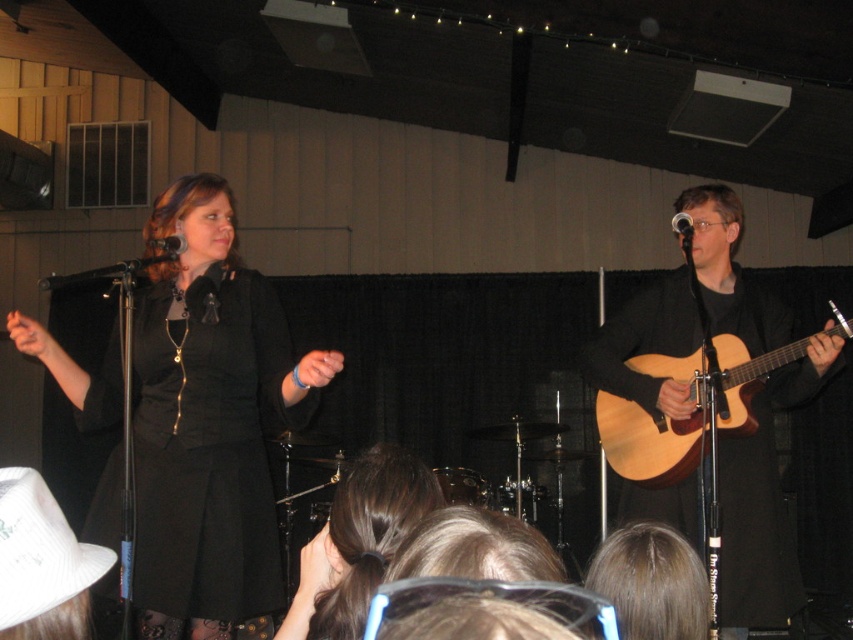
Does light brown acoustic guitar at right have a lesser width compared to brown hair at center?

In fact, light brown acoustic guitar at right might be wider than brown hair at center.

Which is in front, point (689, 538) or point (340, 605)?

Point (340, 605) is in front.

Image resolution: width=853 pixels, height=640 pixels. Find the location of `light brown acoustic guitar at right`. light brown acoustic guitar at right is located at coordinates (764, 500).

Which is below, light brown acoustic guitar at right or white fabric cowboy hat at lower left?

Positioned lower is white fabric cowboy hat at lower left.

From the picture: Which of these two, light brown acoustic guitar at right or white fabric cowboy hat at lower left, stands taller?

light brown acoustic guitar at right

Between point (688, 506) and point (61, 589), which one is positioned in front?

Point (61, 589)

Where is `light brown acoustic guitar at right`? Image resolution: width=853 pixels, height=640 pixels. light brown acoustic guitar at right is located at coordinates (764, 500).

Between white fabric cowboy hat at lower left and metallic silver microphone at upper center, which one appears on the right side from the viewer's perspective?

Positioned to the right is metallic silver microphone at upper center.

Is point (16, 547) positioned in front of point (683, 236)?

That is True.

The image size is (853, 640). Identify the location of white fabric cowboy hat at lower left. (42, 563).